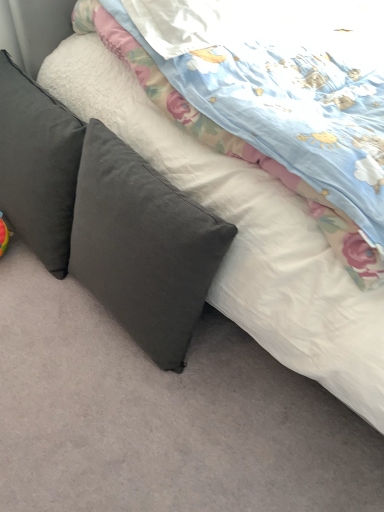
This screenshot has height=512, width=384. What are the coordinates of `vacant space in front of dark gray fabric pillow at left, marked as the 2th pillow in a right-to-left arrangement` in the screenshot? It's located at (35, 309).